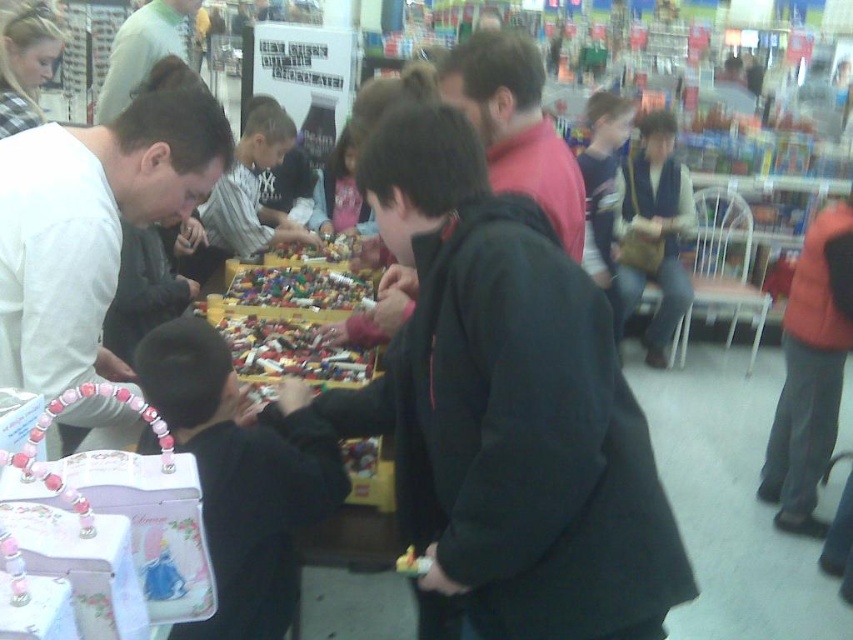
Question: Is brown leather purse at center below light green shirt at upper left?

Choices:
 (A) yes
 (B) no

Answer: (A)

Question: Among these points, which one is nearest to the camera?

Choices:
 (A) (169, 141)
 (B) (294, 273)
 (C) (108, 92)

Answer: (A)

Question: In this image, where is multicolored plastic bricks at center located relative to matte pink shirt at center?

Choices:
 (A) left
 (B) right

Answer: (A)

Question: Which point appears closest to the camera in this image?

Choices:
 (A) (463, 100)
 (B) (178, 58)
 (C) (631, 189)

Answer: (A)

Question: Which point is farther from the camera taking this photo?

Choices:
 (A) (360, 486)
 (B) (103, 260)
 (C) (335, 161)

Answer: (C)

Question: Is white matte shirt at left behind black matte jacket at center?

Choices:
 (A) yes
 (B) no

Answer: (A)